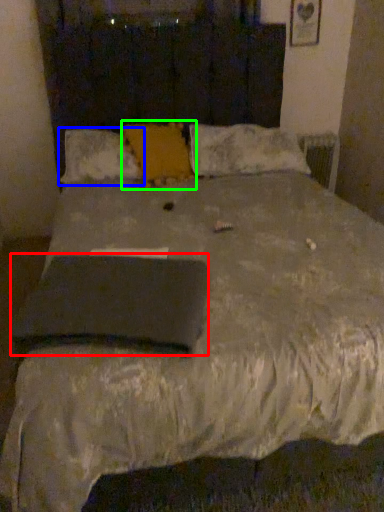
Question: Considering the real-world distances, which object is closest to pad (highlighted by a red box)? pillow (highlighted by a blue box) or pillow (highlighted by a green box).

Choices:
 (A) pillow
 (B) pillow

Answer: (A)